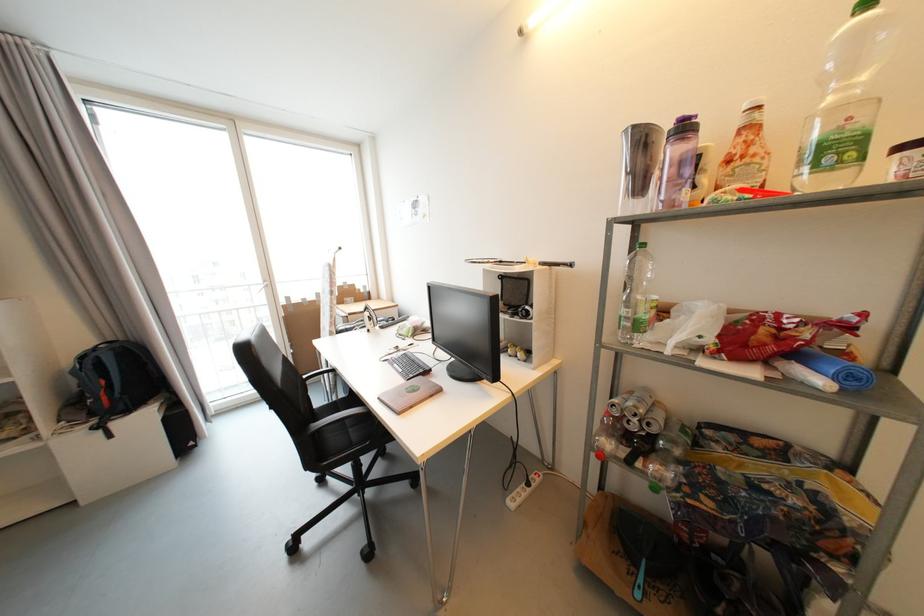
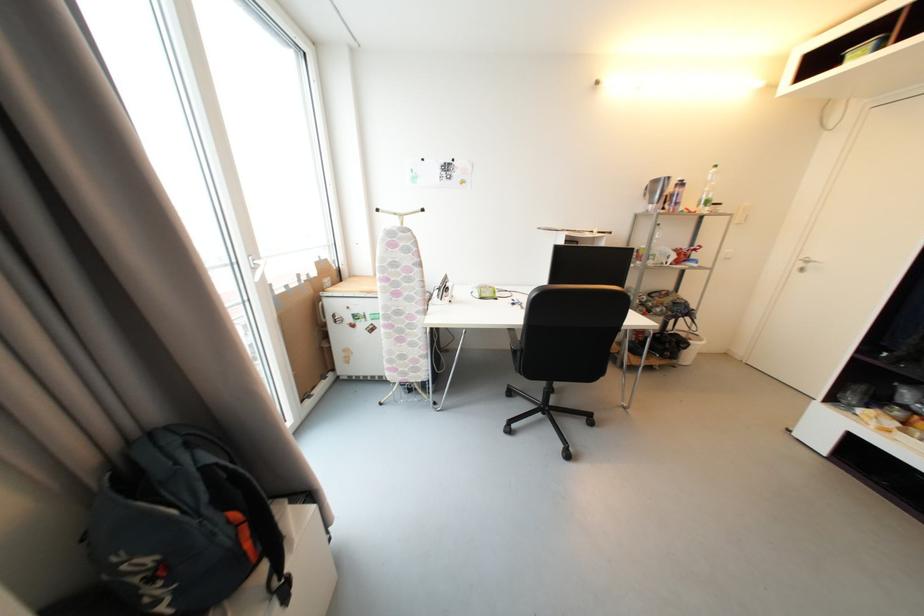
Question: I am providing you with two images of the same scene from different viewpoints. Which of the following objects are not visible in image2?

Choices:
 (A) chair sitting surface
 (B) clear plastic bottle
 (C) silver door handle
 (D) none of these

Answer: (D)